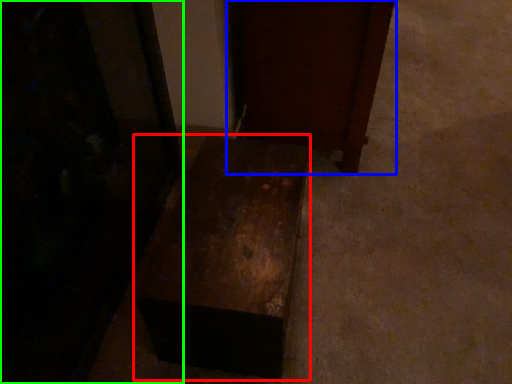
Question: Which is farther away from furniture (highlighted by a red box)? furniture (highlighted by a blue box) or furniture (highlighted by a green box)?

Choices:
 (A) furniture
 (B) furniture

Answer: (A)